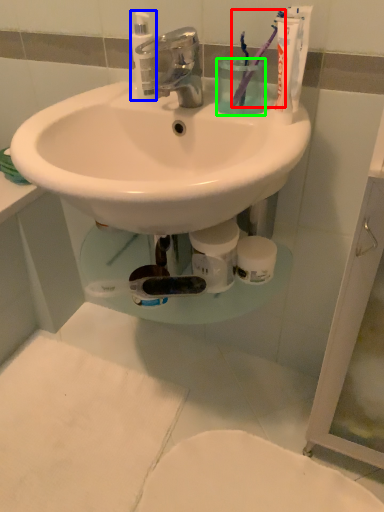
Question: Which object is positioned farthest from toothbrush (highlighted by a red box)? Select from cleaning product (highlighted by a blue box) and liquid (highlighted by a green box).

Choices:
 (A) cleaning product
 (B) liquid

Answer: (A)